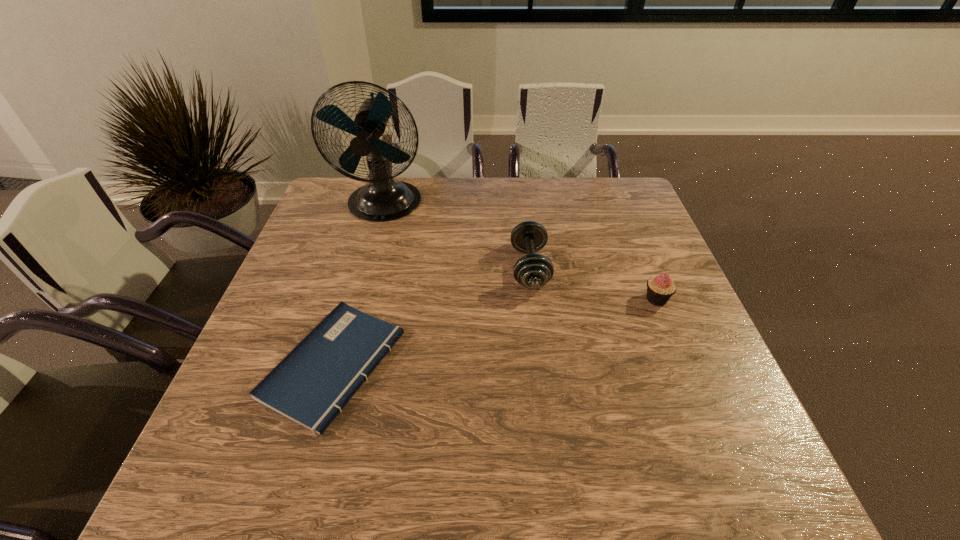
What are the coordinates of `the farthest object` in the screenshot? It's located at (383, 199).

The width and height of the screenshot is (960, 540). Identify the location of the tallest object. (383, 199).

Image resolution: width=960 pixels, height=540 pixels. Find the location of `dumbbell`. dumbbell is located at coordinates coord(533,271).

What are the coordinates of `cupcake` in the screenshot? It's located at (660, 288).

Locate an element on the screen. the third tallest object is located at coordinates point(660,288).

Locate an element on the screen. This screenshot has height=540, width=960. paperback book is located at coordinates (312, 384).

You are a GUI agent. You are given a task and a screenshot of the screen. Output one action in this format:
    pyautogui.click(x=<x>, y=<y>)
    Task: Click on the free space located on the front-facing side of the farthest object
    
    Given the screenshot: What is the action you would take?
    pyautogui.click(x=353, y=311)

Find the location of a particular element. The height and width of the screenshot is (540, 960). vacant space located 0.290m on the back of the dumbbell is located at coordinates (519, 186).

I want to click on free space located on the front of the rightmost object, so click(x=710, y=430).

The width and height of the screenshot is (960, 540). Find the location of `free space located on the back of the paperback book`. free space located on the back of the paperback book is located at coordinates (372, 237).